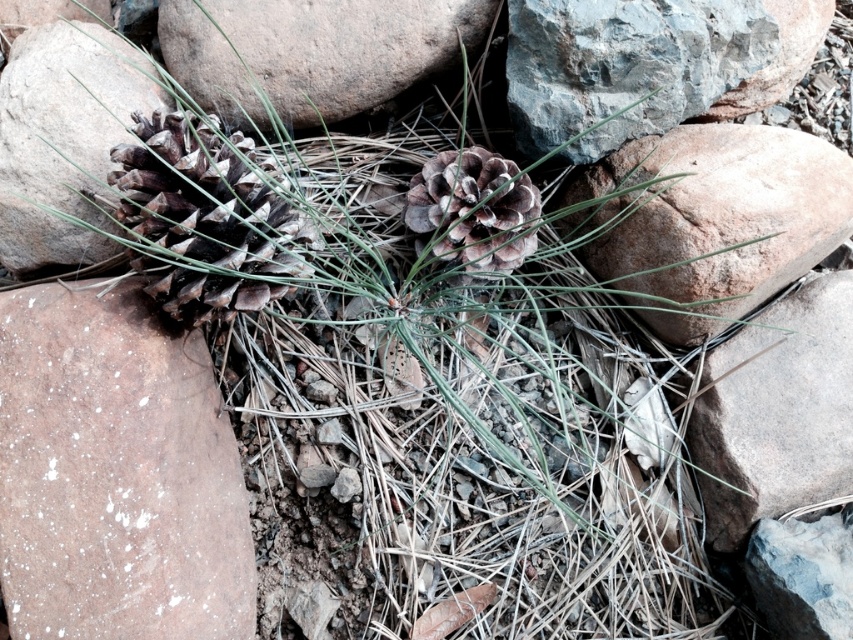
Which of these two, speckled brown rock at lower left or smooth gray rock at upper right, stands shorter?

With less height is smooth gray rock at upper right.

From the picture: Is speckled brown rock at lower left closer to camera compared to smooth gray rock at upper right?

Yes.

Where is `speckled brown rock at lower left`? This screenshot has width=853, height=640. speckled brown rock at lower left is located at coordinates (115, 474).

Between gray rough rock at upper center and gray rough stone at upper center, which one has less height?

gray rough stone at upper center is shorter.

The height and width of the screenshot is (640, 853). Identify the location of gray rough rock at upper center. (624, 67).

Where is `gray rough rock at upper center`? This screenshot has width=853, height=640. gray rough rock at upper center is located at coordinates tap(624, 67).

The width and height of the screenshot is (853, 640). Identify the location of gray rough rock at upper center. (624, 67).

Which is more to the right, speckled brown rock at lower left or gray rough stone at upper center?

gray rough stone at upper center is more to the right.

Is speckled brown rock at lower left above gray rough stone at upper center?

Actually, speckled brown rock at lower left is below gray rough stone at upper center.

Identify the location of speckled brown rock at lower left. The height and width of the screenshot is (640, 853). (115, 474).